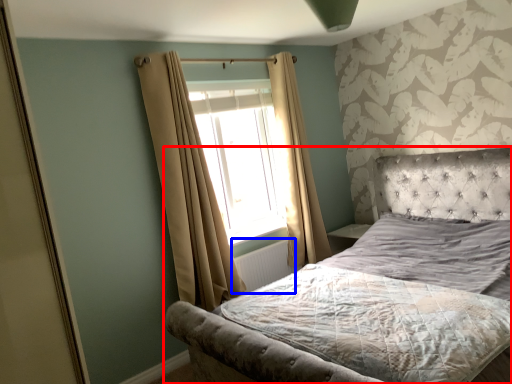
Question: Which object appears farthest to the camera in this image, bed (highlighted by a red box) or radiator (highlighted by a blue box)?

Choices:
 (A) bed
 (B) radiator

Answer: (B)